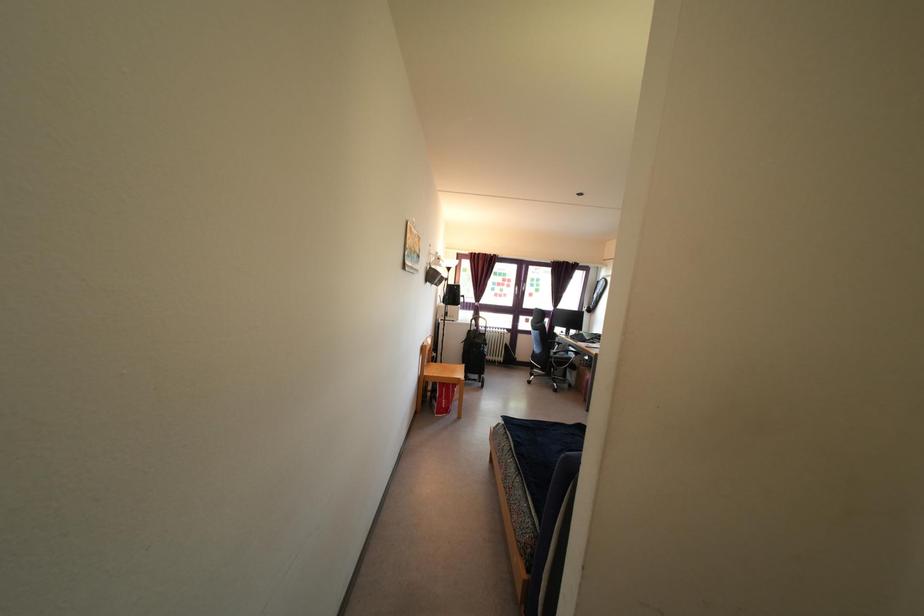
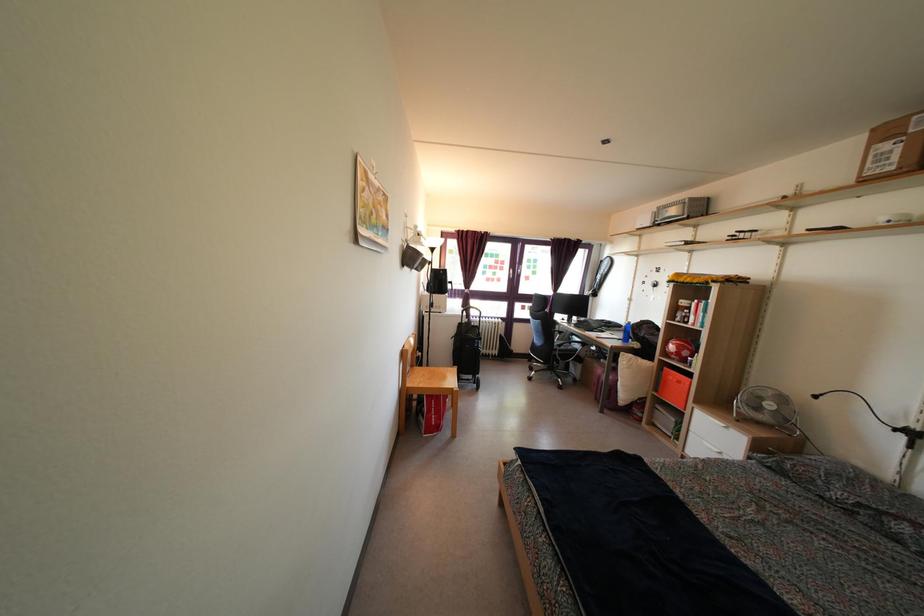
Question: What movement of the cameraman would produce the second image?

Choices:
 (A) Left
 (B) Right
 (C) Forward
 (D) Backward

Answer: (C)